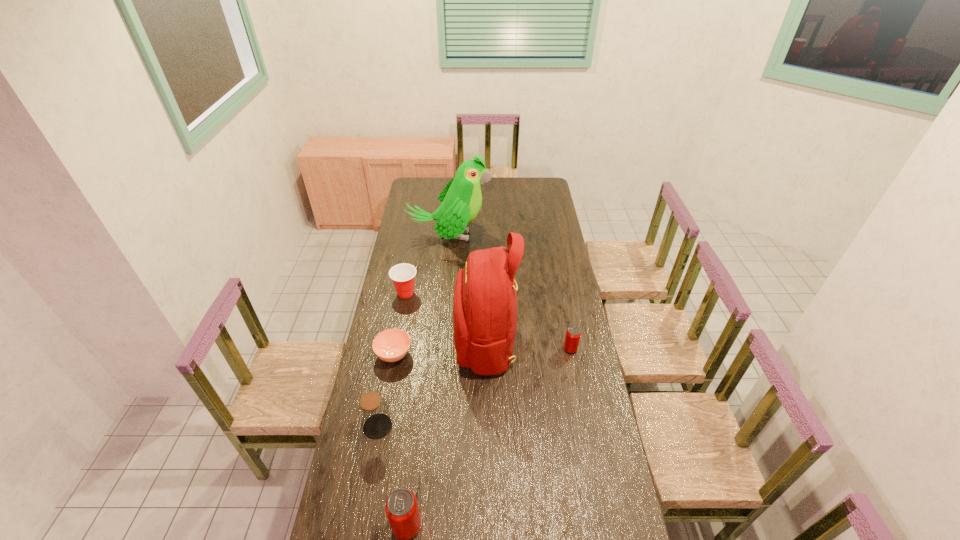
Find the location of a particular element. This screenshot has height=540, width=960. vacant region at the far edge is located at coordinates (494, 180).

The image size is (960, 540). Find the location of `free space at the left edge of the desktop`. free space at the left edge of the desktop is located at coordinates (396, 252).

Where is `free space at the right edge of the desktop`? The height and width of the screenshot is (540, 960). free space at the right edge of the desktop is located at coordinates coord(591,452).

In order to click on free space at the far right corner in this screenshot , I will do click(x=529, y=180).

Where is `vacant area that lies between the farthest object and the soup bowl`? vacant area that lies between the farthest object and the soup bowl is located at coordinates (421, 296).

The width and height of the screenshot is (960, 540). What are the coordinates of `vacant space that's between the parakeet and the shortest object` in the screenshot? It's located at (421, 296).

Identify the location of vacant point located between the shortest object and the cup. This screenshot has height=540, width=960. (399, 323).

This screenshot has width=960, height=540. Find the location of `free space between the rightmost object and the second nearest object`. free space between the rightmost object and the second nearest object is located at coordinates (474, 388).

In order to click on the third closest object to the second nearest object in this screenshot , I will do pos(485,296).

This screenshot has height=540, width=960. I want to click on the third closest object relative to the farther can, so click(461, 199).